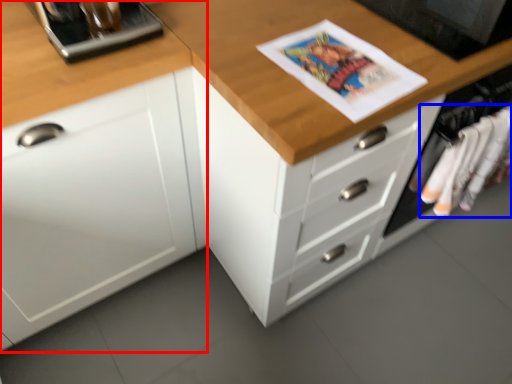
Question: Which object appears farthest to the camera in this image, cabinetry (highlighted by a red box) or clothing (highlighted by a blue box)?

Choices:
 (A) cabinetry
 (B) clothing

Answer: (B)